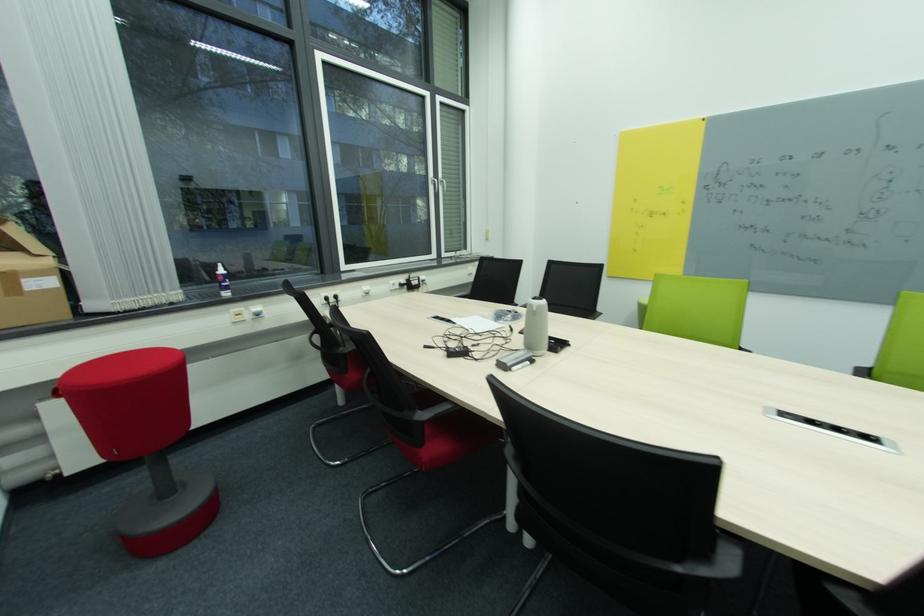
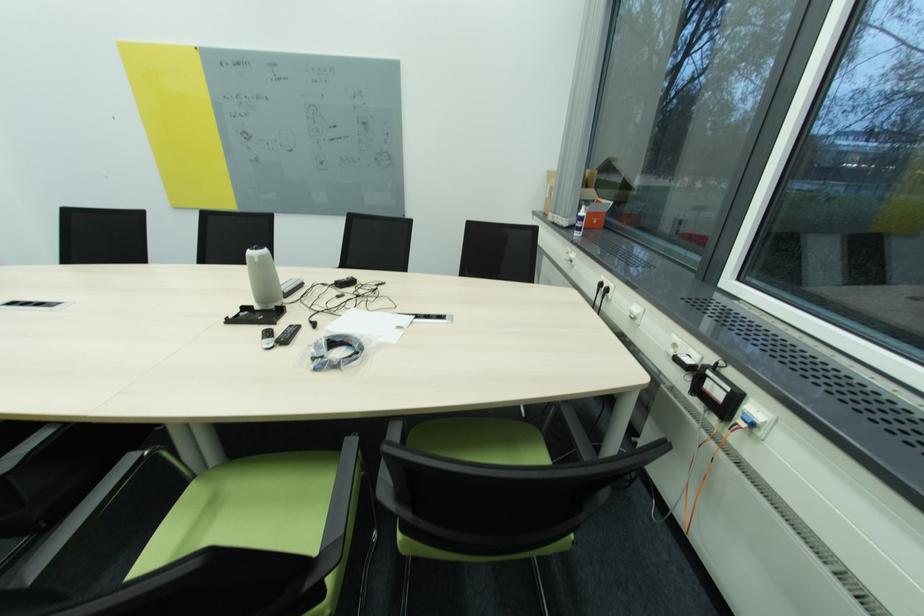
Locate, in the second image, the point that corresponds to point (398, 285) in the first image.

(679, 346)